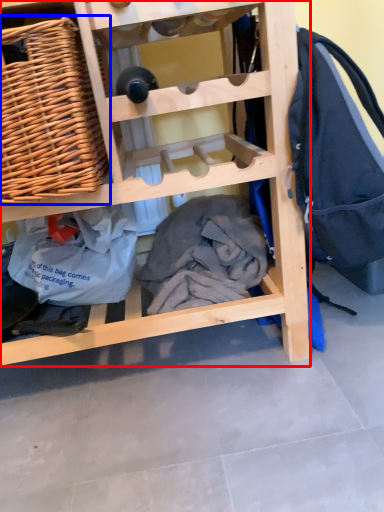
Question: Which point is further to the camera, furniture (highlighted by a red box) or picnic basket (highlighted by a blue box)?

Choices:
 (A) furniture
 (B) picnic basket

Answer: (B)